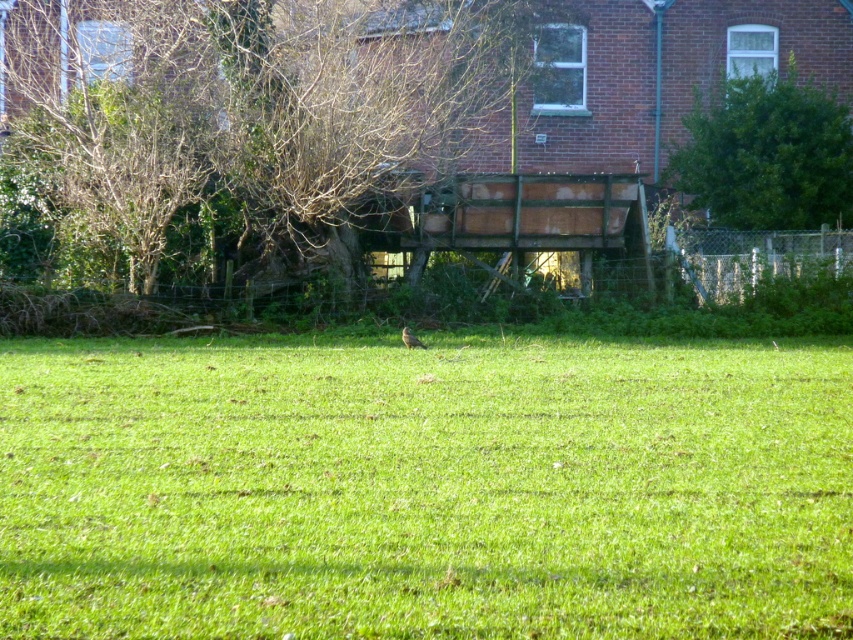
You are a gardener trying to place a 1 meter wide decorative stone between the green grass at center and the brown feathered bird at center. Based on their widths, can the stone fit between them without overlapping either?

The green grass at center might be wider than the brown feathered bird at center, so the 1 meter wide decorative stone may or may not fit between them depending on the exact width of the grass.

You are standing at the origin point of the coordinate system. The wooden structure with metal poles is at point A, and the dense vegetation is at point B. Where is the green grass at center located in relation to these points?

The green grass at center is located at point C, which is between point A and point B.

You are standing at the center of the grassy area and want to take a photo of the brown wood tree at upper center. Based on your current position, in which direction should you move to frame the tree in the center of your camera view?

Since the brown wood tree at upper center is located at coordinates point (231, 129), you should move to the left and slightly downward to center it in your camera view.